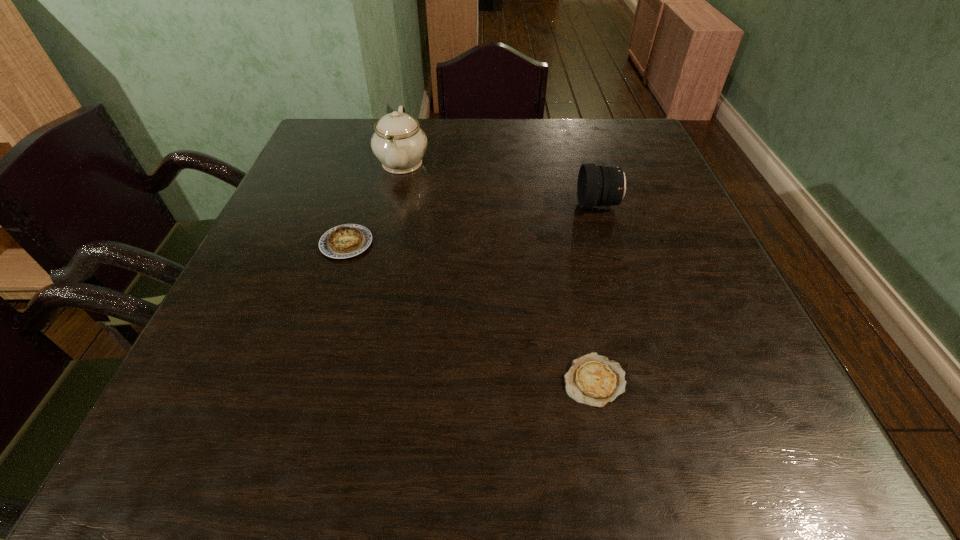
I want to click on free spot between the nearer quiche and the taller quiche, so click(470, 312).

The image size is (960, 540). Identify the location of free spot between the right quiche and the chinaware. (498, 271).

Locate an element on the screen. The height and width of the screenshot is (540, 960). free point between the shortest object and the farthest object is located at coordinates (498, 271).

Locate an element on the screen. free space between the nearer quiche and the chinaware is located at coordinates (498, 271).

Choose which object is the nearest neighbor to the third shortest object. Please provide its 2D coordinates. Your answer should be formatted as a tuple, i.e. [(x, y)], where the tuple contains the x and y coordinates of a point satisfying the conditions above.

[(398, 142)]

Where is `the second closest object relative to the third shortest object`? The width and height of the screenshot is (960, 540). the second closest object relative to the third shortest object is located at coordinates (592, 379).

This screenshot has height=540, width=960. Identify the location of blank space that satisfies the following two spatial constraints: 1. on the front side of the farther quiche; 2. on the right side of the nearest object. coord(303,380).

The width and height of the screenshot is (960, 540). Find the location of `free location that satisfies the following two spatial constraints: 1. on the front side of the right quiche; 2. on the left side of the taller quiche`. free location that satisfies the following two spatial constraints: 1. on the front side of the right quiche; 2. on the left side of the taller quiche is located at coordinates (303, 380).

I want to click on free region that satisfies the following two spatial constraints: 1. at the front element of the third nearest object; 2. on the front side of the nearest object, so click(x=653, y=380).

Where is `free space that satisfies the following two spatial constraints: 1. at the spout of the farthest object; 2. on the right side of the shorter quiche`? This screenshot has height=540, width=960. free space that satisfies the following two spatial constraints: 1. at the spout of the farthest object; 2. on the right side of the shorter quiche is located at coordinates (353, 380).